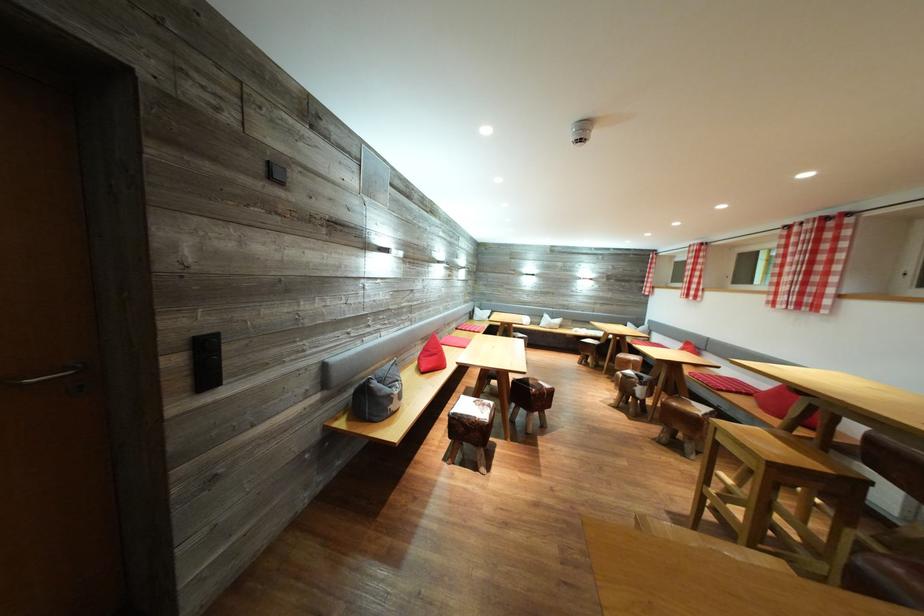
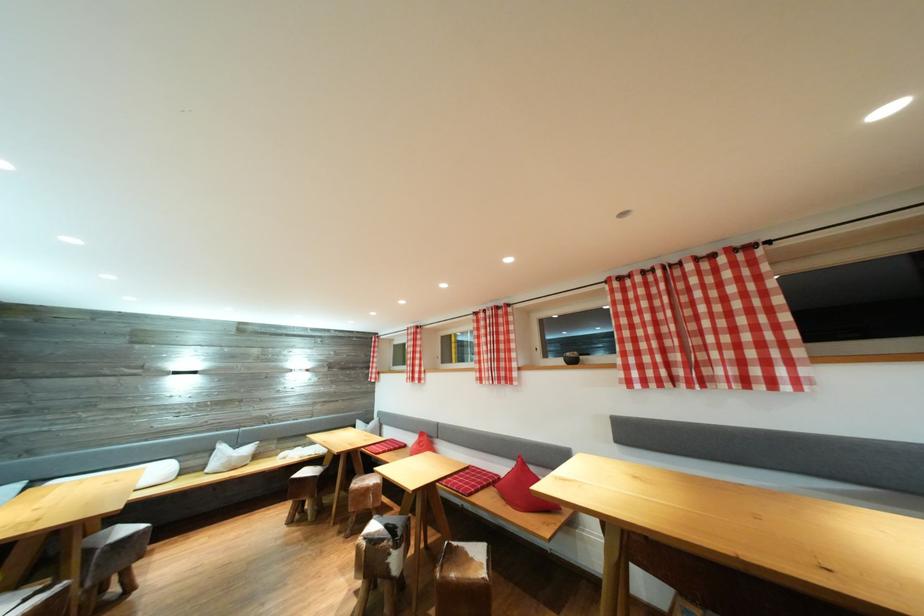
Find the pixel in the second image that matches [650,286] in the first image.

(375, 373)